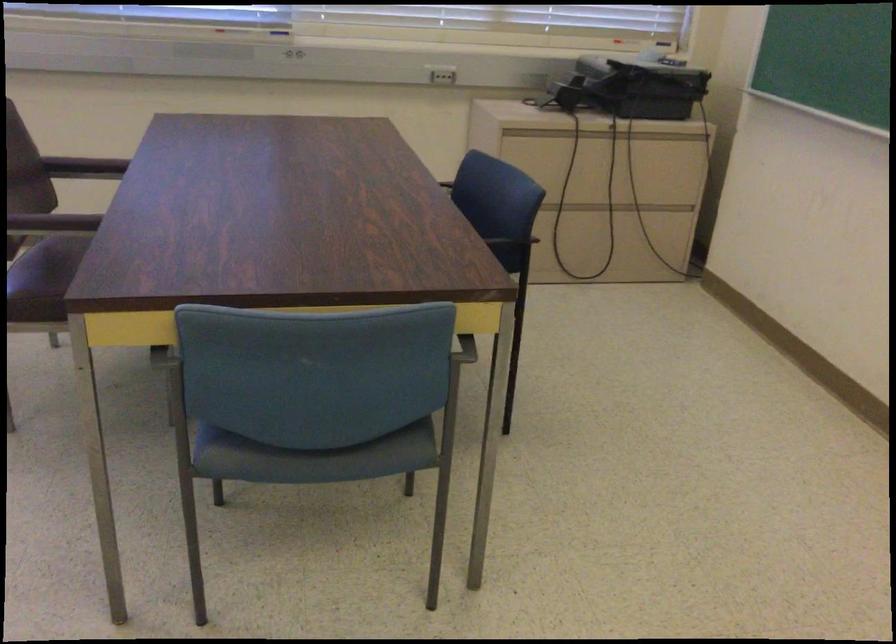
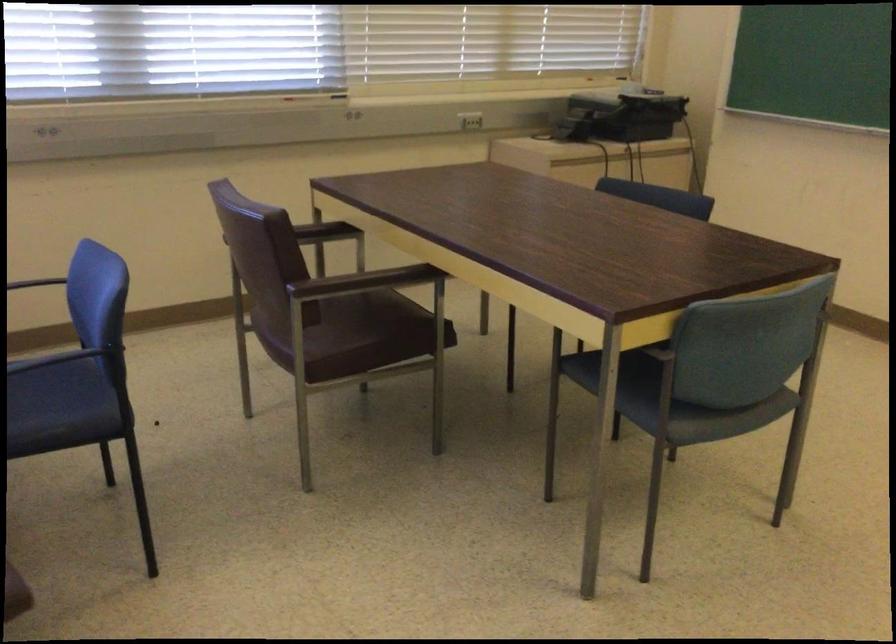
In the second image, find the point that corresponds to point (235, 398) in the first image.

(625, 384)